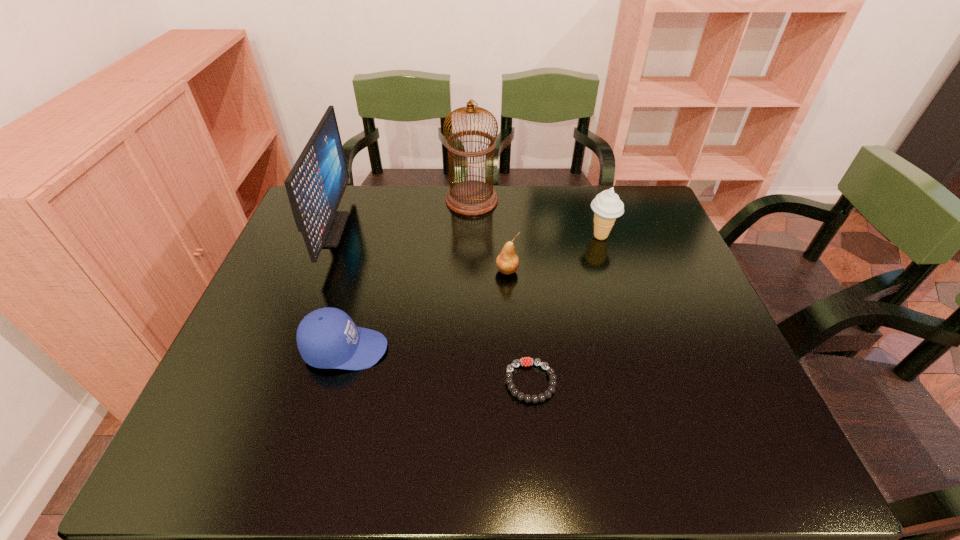
The height and width of the screenshot is (540, 960). I want to click on free space between the cap and the rightmost object, so click(x=473, y=293).

What are the coordinates of `free area in between the birdcage and the computer monitor` in the screenshot? It's located at (400, 215).

The width and height of the screenshot is (960, 540). Identify the location of empty location between the fourth tallest object and the second shortest object. (426, 310).

The image size is (960, 540). Identify the location of object that is the fourth closest to the fourth tallest object. (327, 338).

Locate an element on the screen. the fourth closest object to the fourth shortest object is located at coordinates (327, 338).

Where is `free space that satisfies the following two spatial constraints: 1. on the front-facing side of the birdcage; 2. on the right side of the pear`? The height and width of the screenshot is (540, 960). free space that satisfies the following two spatial constraints: 1. on the front-facing side of the birdcage; 2. on the right side of the pear is located at coordinates (470, 271).

At what (x,y) coordinates should I click in order to perform the action: click on vacant space that satisfies the following two spatial constraints: 1. on the front-facing side of the birdcage; 2. on the left side of the fourth shortest object. Please return your answer as a coordinate pair (x, y). This screenshot has width=960, height=540. Looking at the image, I should click on (470, 236).

Identify the location of blank area in the image that satisfies the following two spatial constraints: 1. on the front-facing side of the birdcage; 2. on the back side of the bracelet. (468, 382).

The image size is (960, 540). I want to click on free spot that satisfies the following two spatial constraints: 1. on the front side of the pear; 2. on the front-facing side of the fifth object from right to left, so click(x=512, y=349).

You are a GUI agent. You are given a task and a screenshot of the screen. Output one action in this format:
    pyautogui.click(x=<x>, y=<y>)
    Task: Click on the vacant region that satisfies the following two spatial constraints: 1. on the front side of the third tallest object; 2. on the front-facing side of the cap
    This screenshot has width=960, height=540.
    Given the screenshot: What is the action you would take?
    pyautogui.click(x=636, y=349)